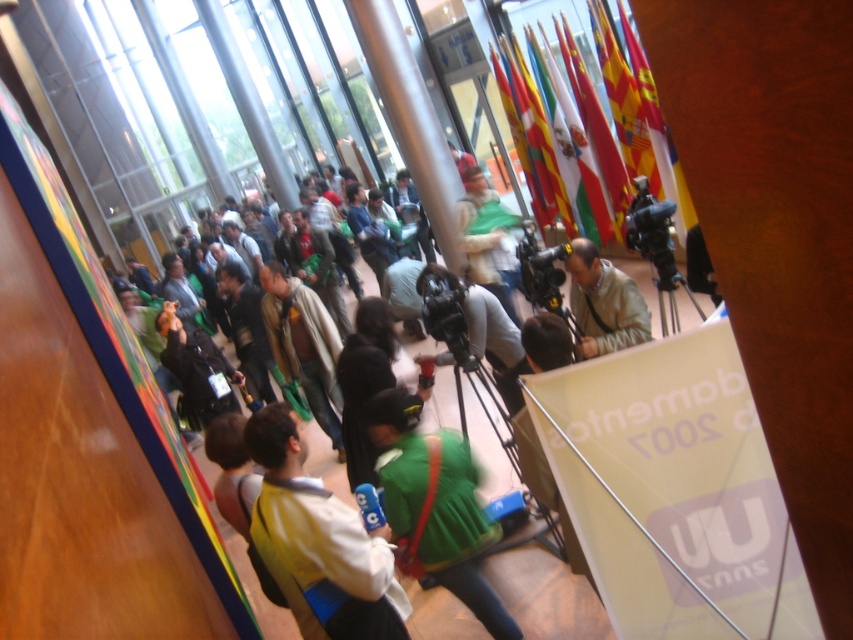
Between point (653, 262) and point (543, 250), which one is positioned behind?

The point (543, 250) is behind.

Can you confirm if black plastic video camera at center right is taller than black plastic video camera at center?

No, black plastic video camera at center right is not taller than black plastic video camera at center.

Where is `black plastic video camera at center right`? black plastic video camera at center right is located at coordinates [653, 234].

Between point (466, 563) and point (664, 282), which one is positioned in front?

Point (466, 563)

Does green fabric bag at center appear on the right side of black plastic video camera at center right?

In fact, green fabric bag at center is to the left of black plastic video camera at center right.

At what (x,y) coordinates should I click in order to perform the action: click on green fabric bag at center. Please return your answer as a coordinate pair (x, y). This screenshot has width=853, height=640. Looking at the image, I should click on (434, 506).

The height and width of the screenshot is (640, 853). I want to click on green fabric bag at center, so click(x=434, y=506).

Between green fabric flag at center and red flag at upper center, which one has less height?

red flag at upper center is shorter.

Does green fabric flag at center have a greater width compared to red flag at upper center?

Yes, green fabric flag at center is wider than red flag at upper center.

Is point (521, 136) positioned in front of point (624, 189)?

No, it is behind (624, 189).

The width and height of the screenshot is (853, 640). I want to click on green fabric flag at center, so click(x=531, y=141).